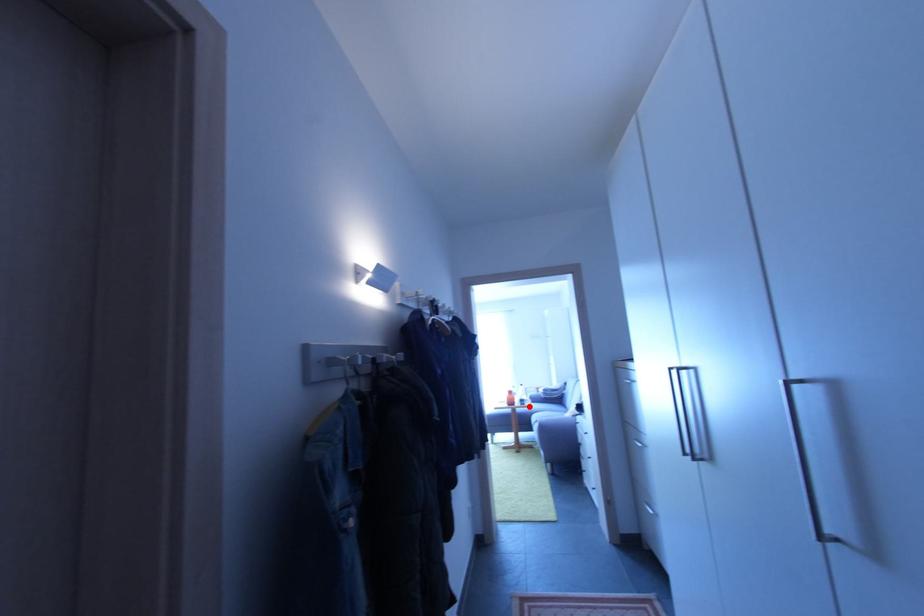
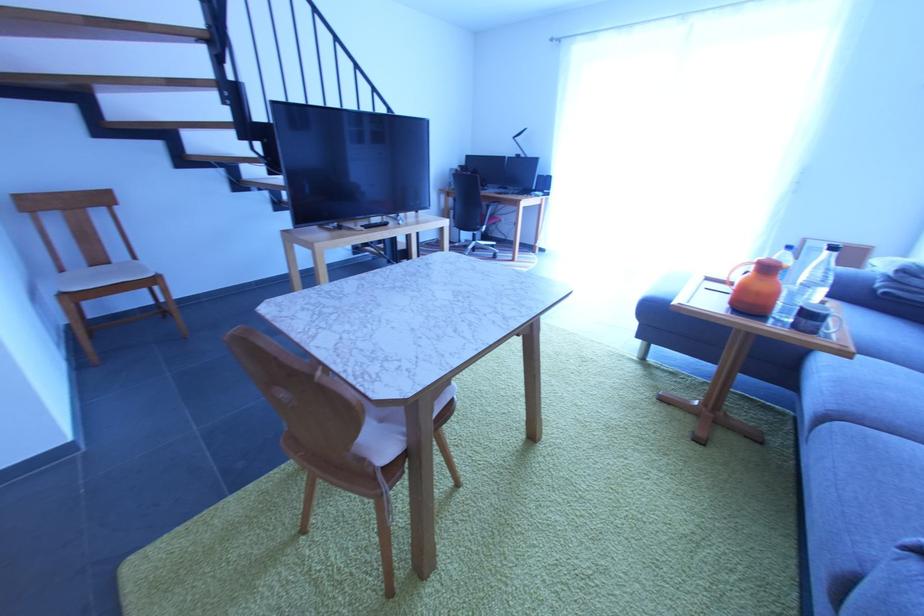
Question: I am providing you with two images of the same scene from different viewpoints. In image1, a red point is highlighted. Considering the same 3D point in image2, which of the following is correct?

Choices:
 (A) It is closer
 (B) It is farther

Answer: (A)